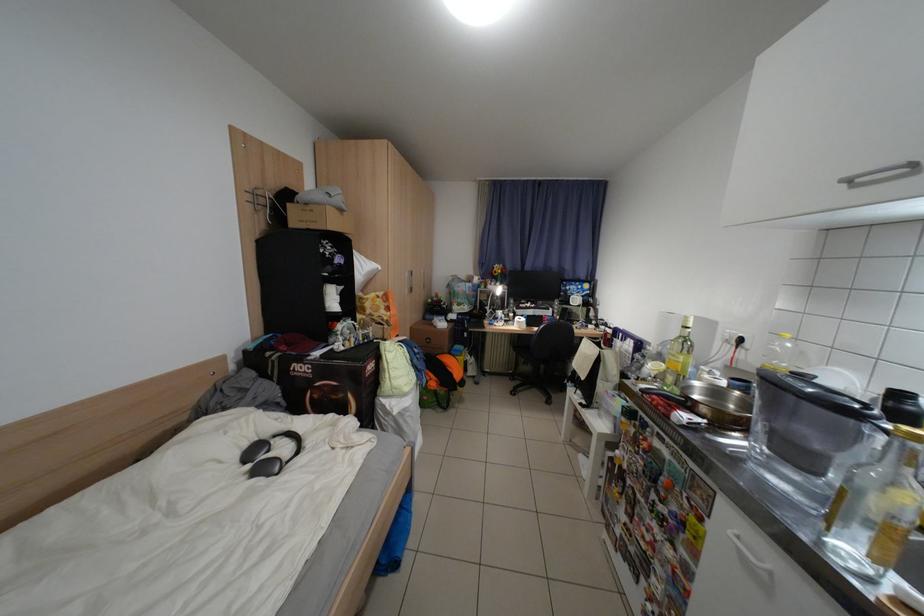
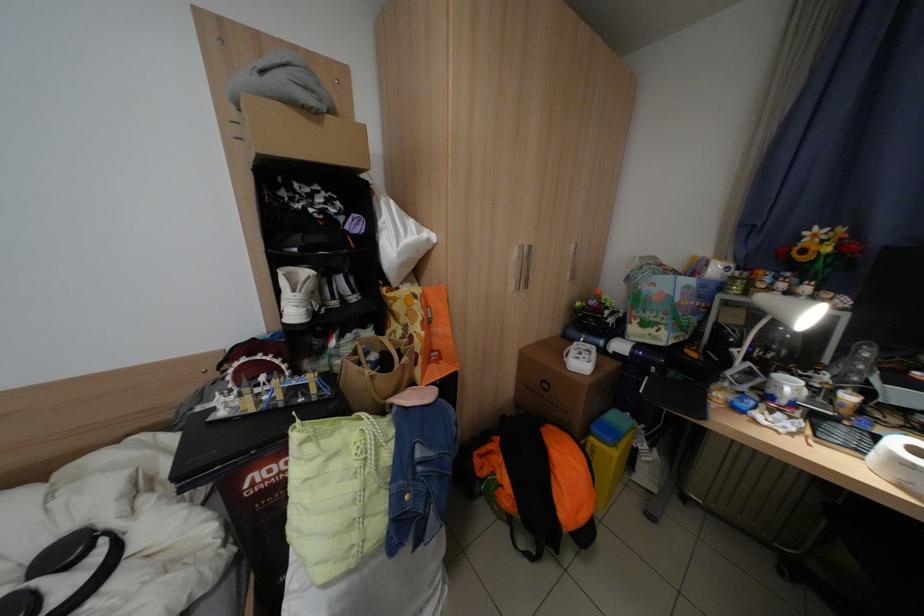
Where in the second image is the point corresponding to pixel 440 342 from the first image?

(555, 387)